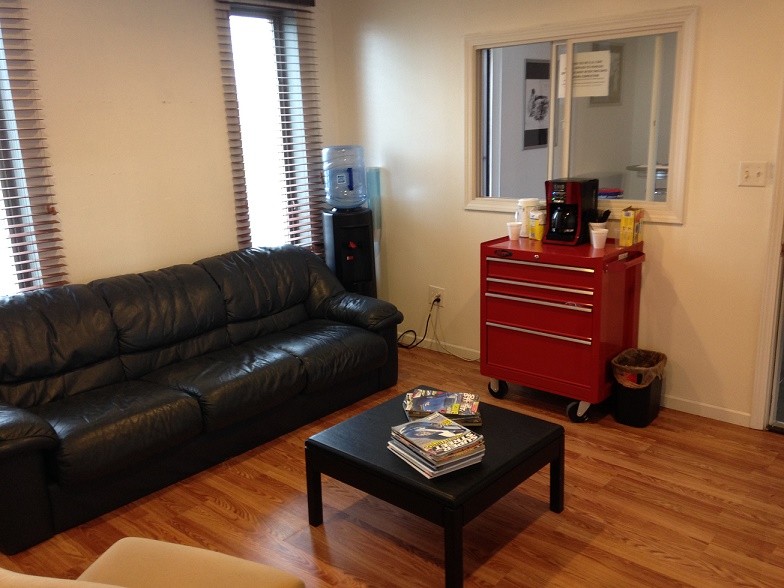
Identify the location of window blinds. (267, 112), (15, 210).